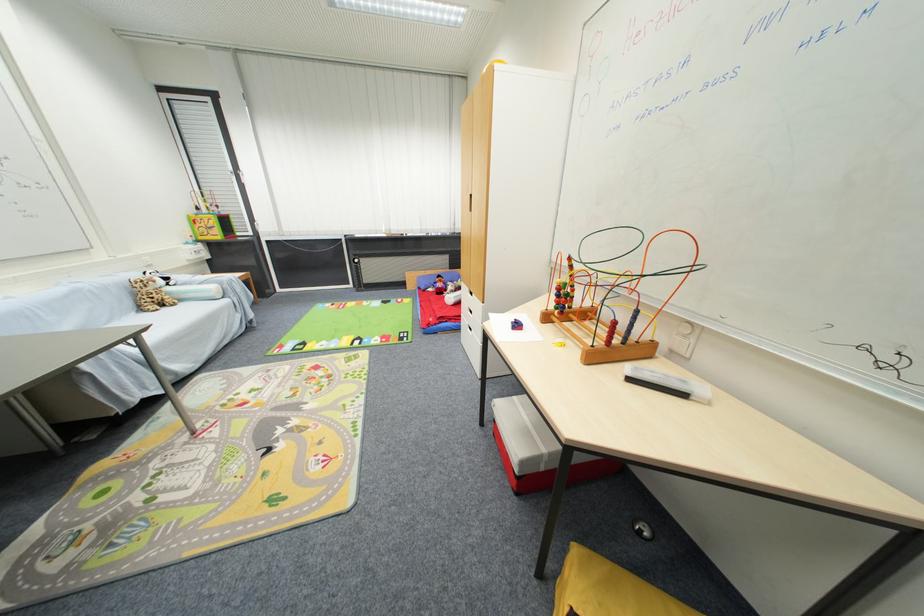
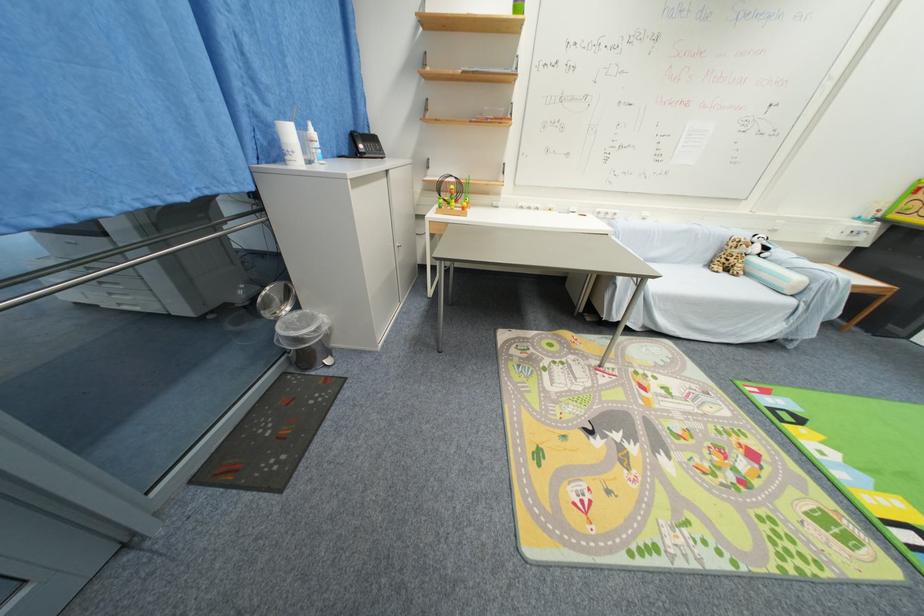
The point at (165, 283) is marked in the first image. Where is the corresponding point in the second image?

(761, 251)